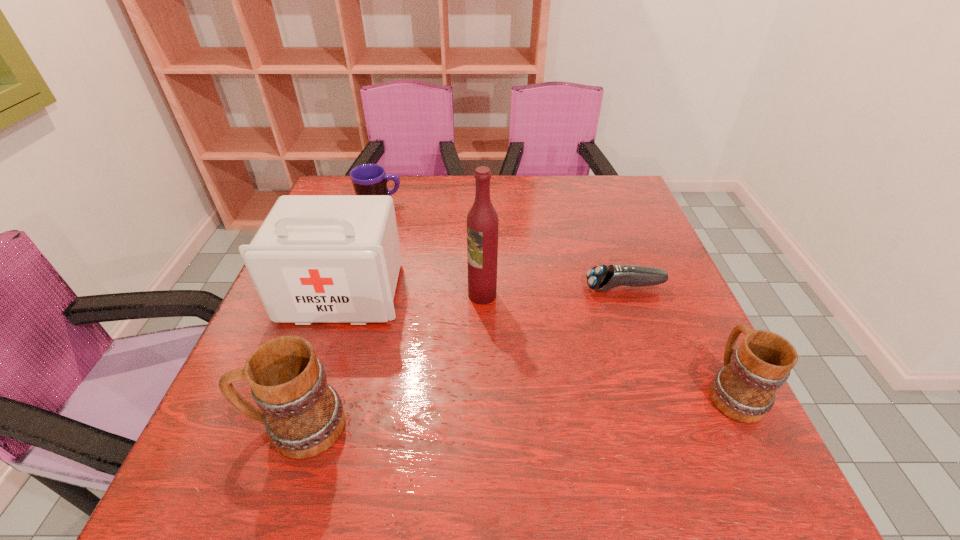
Identify the location of blank space at the near right corner of the desktop. This screenshot has width=960, height=540. (728, 428).

Find the location of `vacant space that is in between the farthest object and the second shortest mug`. vacant space that is in between the farthest object and the second shortest mug is located at coordinates tap(556, 296).

I want to click on free space between the shortest object and the liquor, so click(553, 291).

Image resolution: width=960 pixels, height=540 pixels. What are the coordinates of `vacant area between the liquor and the rightmost mug` in the screenshot? It's located at (607, 342).

Where is `free space between the electric shaver and the fourth object from left to right`? free space between the electric shaver and the fourth object from left to right is located at coordinates (553, 291).

The height and width of the screenshot is (540, 960). I want to click on vacant area that lies between the fourth shortest object and the shortest object, so click(x=460, y=357).

Locate an element on the screen. free point between the fifth shortest object and the rightmost mug is located at coordinates (538, 341).

Find the location of a particular element. free space between the shortest mug and the third object from right to left is located at coordinates (431, 249).

At what (x,y) coordinates should I click in order to perform the action: click on empty space that is in between the electric shaver and the fourth shortest object. Please return your answer as a coordinate pair (x, y). Looking at the image, I should click on (460, 357).

You are a GUI agent. You are given a task and a screenshot of the screen. Output one action in this format:
    pyautogui.click(x=<x>, y=<y>)
    Task: Click on the vacant space that's between the liquor and the second tallest mug
    The height and width of the screenshot is (540, 960).
    Given the screenshot: What is the action you would take?
    pyautogui.click(x=607, y=342)